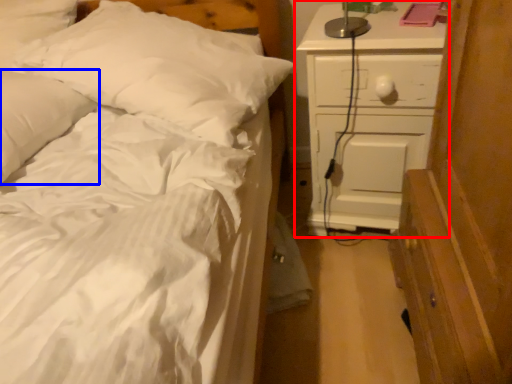
Question: Which of the following is the farthest to the observer, chest of drawers (highlighted by a red box) or pillow (highlighted by a blue box)?

Choices:
 (A) chest of drawers
 (B) pillow

Answer: (A)